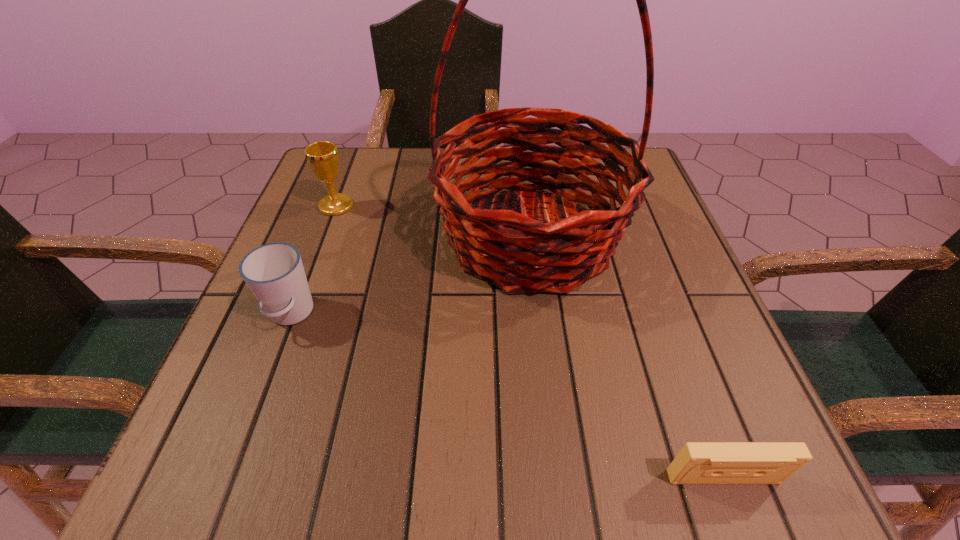
You are a GUI agent. You are given a task and a screenshot of the screen. Output one action in this format:
    pyautogui.click(x=<x>, y=<y>)
    Task: Click on the vacant region between the third shortest object and the basket
    
    Given the screenshot: What is the action you would take?
    pyautogui.click(x=433, y=221)

Locate an element on the screen. Image resolution: width=960 pixels, height=540 pixels. blank region between the cup and the tallest object is located at coordinates [x=410, y=275].

Where is `free space between the third shortest object and the tallest object`? Image resolution: width=960 pixels, height=540 pixels. free space between the third shortest object and the tallest object is located at coordinates (433, 221).

Locate which object ranks second in proximity to the cup. Please provide its 2D coordinates. Your answer should be formatted as a tuple, i.e. [(x, y)], where the tuple contains the x and y coordinates of a point satisfying the conditions above.

[(322, 157)]

This screenshot has height=540, width=960. Find the location of `object that is the third closest one to the basket`. object that is the third closest one to the basket is located at coordinates (698, 462).

The image size is (960, 540). Identify the location of free space that satisfies the following two spatial constraints: 1. on the front side of the tallest object; 2. on the left side of the chalice. (324, 237).